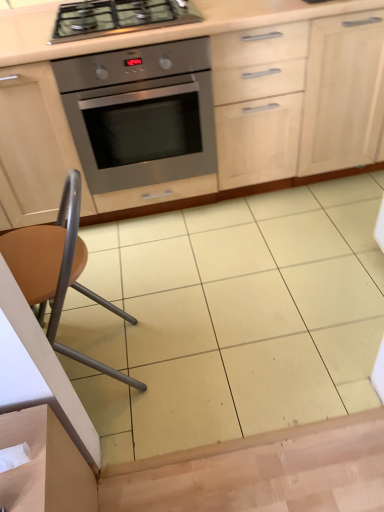
Question: Considering the relative positions of matte wood cabinetry at center and stainless steel gas stove at upper center in the image provided, is matte wood cabinetry at center behind stainless steel gas stove at upper center?

Choices:
 (A) yes
 (B) no

Answer: (B)

Question: Is matte wood cabinetry at center directly adjacent to stainless steel gas stove at upper center?

Choices:
 (A) yes
 (B) no

Answer: (B)

Question: Does matte wood cabinetry at center appear on the left side of stainless steel gas stove at upper center?

Choices:
 (A) yes
 (B) no

Answer: (B)

Question: Considering the relative sizes of matte wood cabinetry at center and stainless steel gas stove at upper center in the image provided, is matte wood cabinetry at center wider than stainless steel gas stove at upper center?

Choices:
 (A) no
 (B) yes

Answer: (B)

Question: Does matte wood cabinetry at center have a lesser height compared to stainless steel gas stove at upper center?

Choices:
 (A) no
 (B) yes

Answer: (A)

Question: Considering the relative positions of matte wood cabinetry at center and stainless steel gas stove at upper center in the image provided, is matte wood cabinetry at center in front of stainless steel gas stove at upper center?

Choices:
 (A) no
 (B) yes

Answer: (B)

Question: From a real-world perspective, does matte wood cabinetry at center stand above stainless steel oven at center?

Choices:
 (A) yes
 (B) no

Answer: (A)

Question: Considering the relative sizes of matte wood cabinetry at center and stainless steel oven at center in the image provided, is matte wood cabinetry at center taller than stainless steel oven at center?

Choices:
 (A) yes
 (B) no

Answer: (A)

Question: Is matte wood cabinetry at center far away from stainless steel oven at center?

Choices:
 (A) no
 (B) yes

Answer: (A)

Question: Does matte wood cabinetry at center have a greater width compared to stainless steel oven at center?

Choices:
 (A) no
 (B) yes

Answer: (A)

Question: Considering the relative sizes of matte wood cabinetry at center and stainless steel oven at center in the image provided, is matte wood cabinetry at center smaller than stainless steel oven at center?

Choices:
 (A) no
 (B) yes

Answer: (A)

Question: Is matte wood cabinetry at center closer to camera compared to stainless steel oven at center?

Choices:
 (A) yes
 (B) no

Answer: (A)

Question: Would you say matte wood cabinetry at center is part of stainless steel oven at center's contents?

Choices:
 (A) yes
 (B) no

Answer: (B)